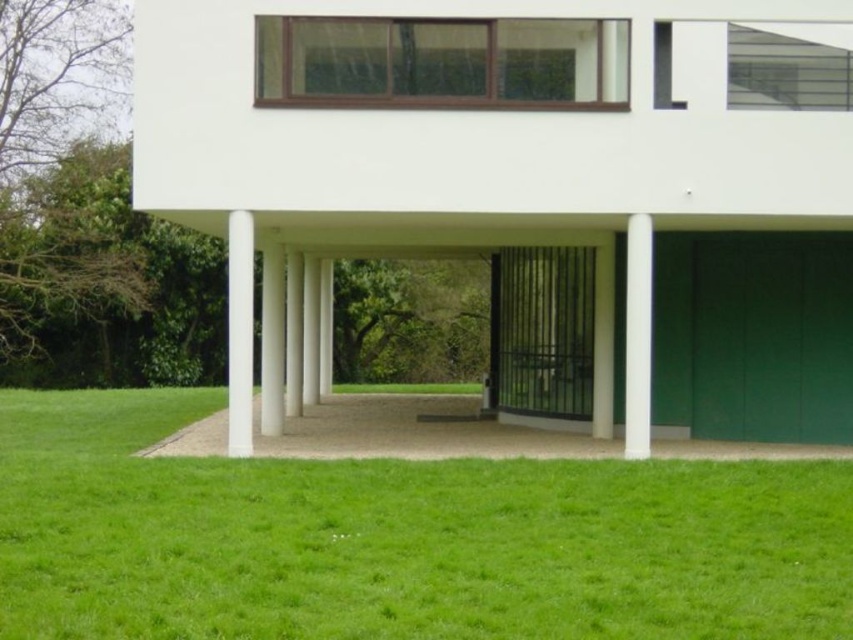
In the scene shown: Is green grass at lower center to the left of white smooth column at right from the viewer's perspective?

Yes, green grass at lower center is to the left of white smooth column at right.

Is green grass at lower center wider than white smooth column at right?

Yes.

Between point (398, 528) and point (642, 282), which one is positioned behind?

The point (642, 282) is behind.

This screenshot has width=853, height=640. In order to click on green grass at lower center in this screenshot , I will do `click(398, 540)`.

Does green grass at lower center appear on the left side of green matte/glossy garage door at lower right?

Correct, you'll find green grass at lower center to the left of green matte/glossy garage door at lower right.

Which is behind, point (167, 472) or point (792, 436)?

Positioned behind is point (792, 436).

Where is `green grass at lower center`? green grass at lower center is located at coordinates (398, 540).

Looking at this image, is white smooth column at right positioned at the back of white smooth pillar at center?

Yes, it is behind white smooth pillar at center.

Is white smooth column at right thinner than white smooth pillar at center?

Correct, white smooth column at right's width is less than white smooth pillar at center's.

The image size is (853, 640). Find the location of `white smooth column at right`. white smooth column at right is located at coordinates [x=637, y=336].